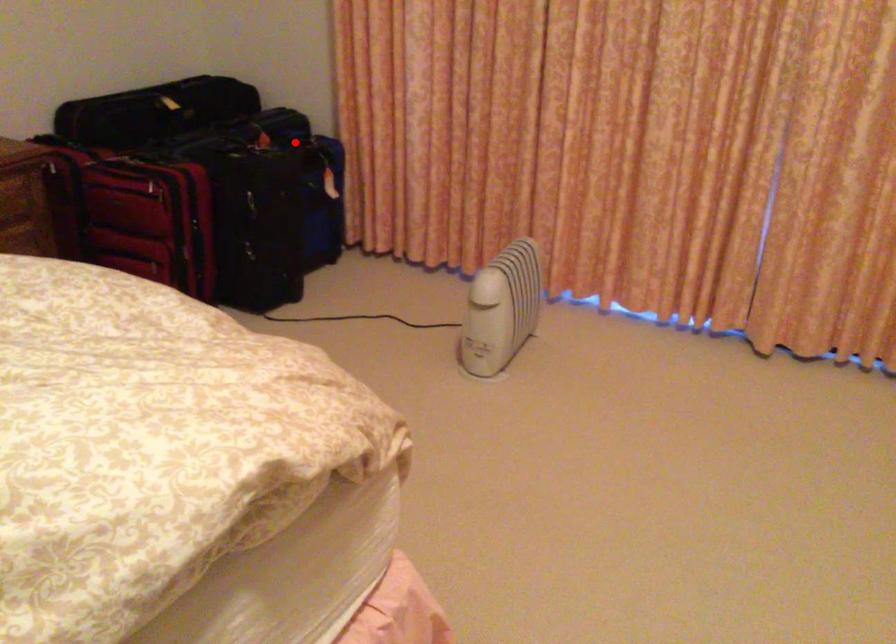
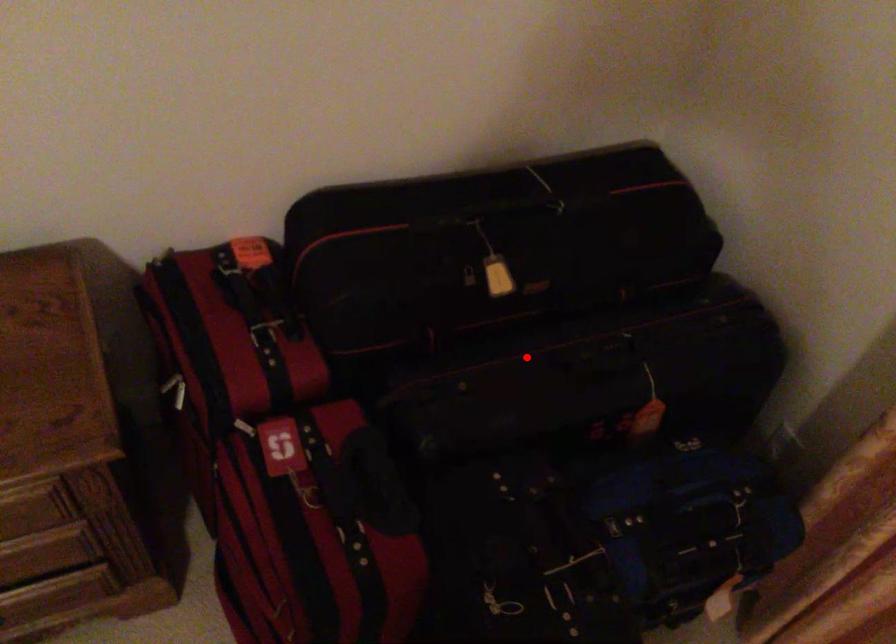
I am providing you with two images of the same scene from different viewpoints. A red point is marked on the first image and another point is marked on the second image. Are the points marked in image1 and image2 representing the same 3D position?

No